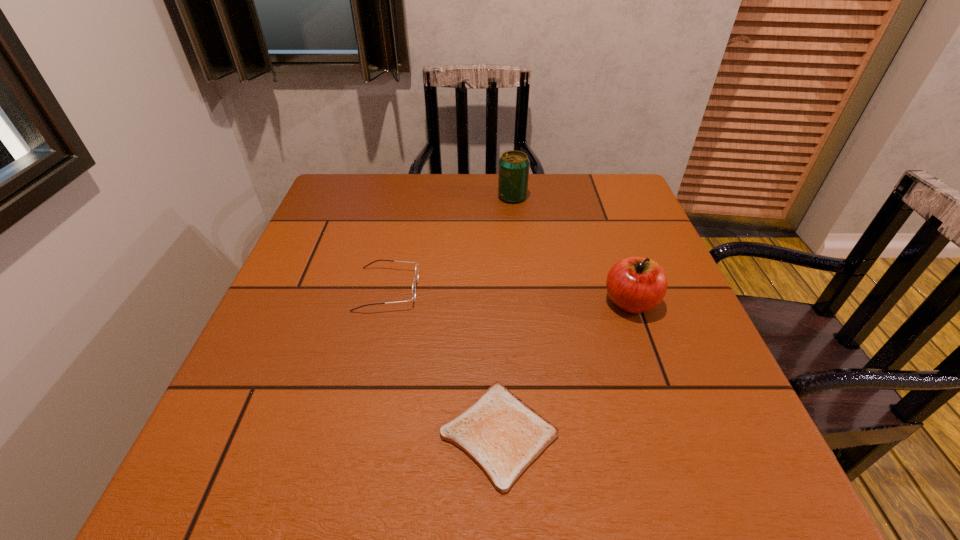
Locate an element on the screen. vacant area in the image that satisfies the following two spatial constraints: 1. through the lenses of the rightmost object; 2. on the right side of the leftmost object is located at coordinates (385, 302).

Locate an element on the screen. The width and height of the screenshot is (960, 540). free point that satisfies the following two spatial constraints: 1. on the back side of the nearest object; 2. on the left side of the rightmost object is located at coordinates (494, 302).

Where is `free space that satisfies the following two spatial constraints: 1. through the lenses of the leftmost object; 2. on the right side of the toast`? The width and height of the screenshot is (960, 540). free space that satisfies the following two spatial constraints: 1. through the lenses of the leftmost object; 2. on the right side of the toast is located at coordinates (355, 434).

In order to click on free point that satisfies the following two spatial constraints: 1. through the lenses of the second shortest object; 2. on the right side of the rightmost object in this screenshot , I will do `click(385, 302)`.